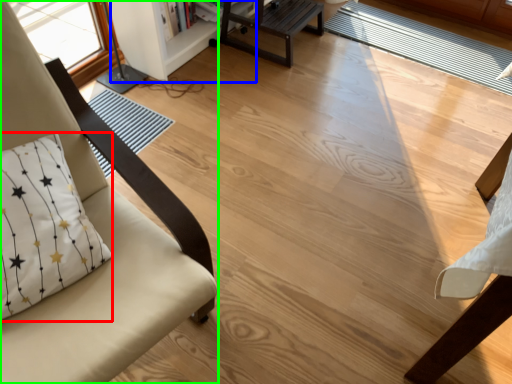
Question: Considering the real-world distances, which object is farthest from pillow (highlighted by a red box)? bookshelf (highlighted by a blue box) or chair (highlighted by a green box)?

Choices:
 (A) bookshelf
 (B) chair

Answer: (A)